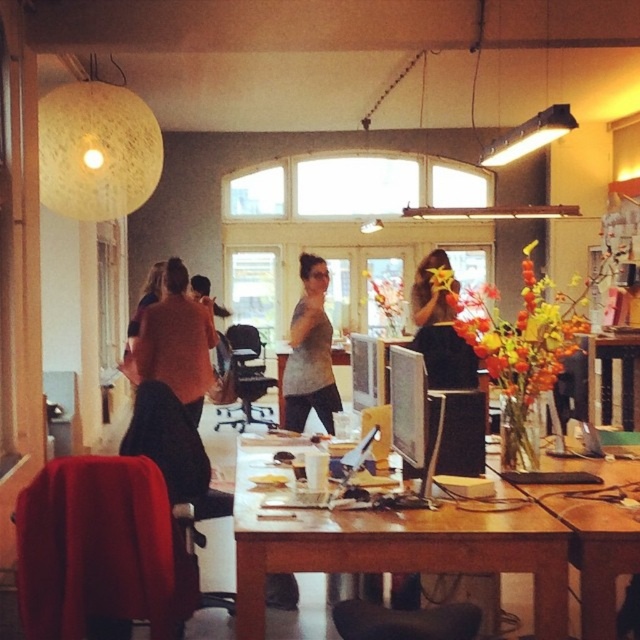
You are standing at the entrance of the office and want to place a new desk lamp on the wooden table at center. According to the coordinates provided, where should you aim to place the lamp?

The wooden table at center is located at coordinates point (595,534), so you should aim for that point to place the desk lamp there.

You are organizing a charity event and need to display two items on a narrow shelf. The shelf can only accommodate items up to 40 cm in width. You have the matte pink shirt at center and the matte gray sweater at center. Based on the scene description, which item is more likely to fit on the shelf?

The matte gray sweater at center is more likely to fit on the shelf since its width is smaller than the matte pink shirt at center, which exceeds the 40 cm limit.

You are organizing a charity event and need to decide which clothing item to display first. Both the matte pink shirt at center and the matte gray sweater at center are on the table. Which item should you choose if you want to showcase the larger one first?

The matte pink shirt at center is larger in size than the matte gray sweater at center, so you should choose the matte pink shirt at center to display first.